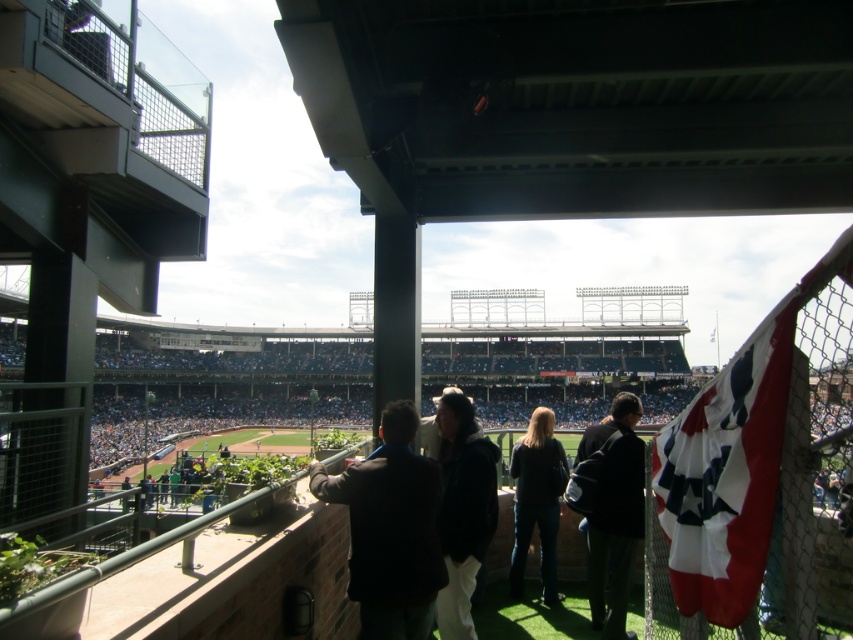
You are a photographer trying to capture a wide shot of the baseball stadium scene. You notice the red and white fabric flag at right and the dark brown leather jacket at center. Which object should you focus on to ensure maximum visibility in your photo given their size differences?

The red and white fabric flag at right has a larger width than the dark brown leather jacket at center, so focusing on the red and white fabric flag at right would ensure maximum visibility due to its greater size.

You are a photographer standing in the luxury box at the baseball stadium. You want to take a photo of the dark blue jeans at center without the red and white fabric flag at right appearing in the frame. Is it possible to angle your camera downward to achieve this?

The red and white fabric flag at right is above the dark blue jeans at center, so angling the camera downward would allow you to capture the dark blue jeans at center without the flag obstructing the view.